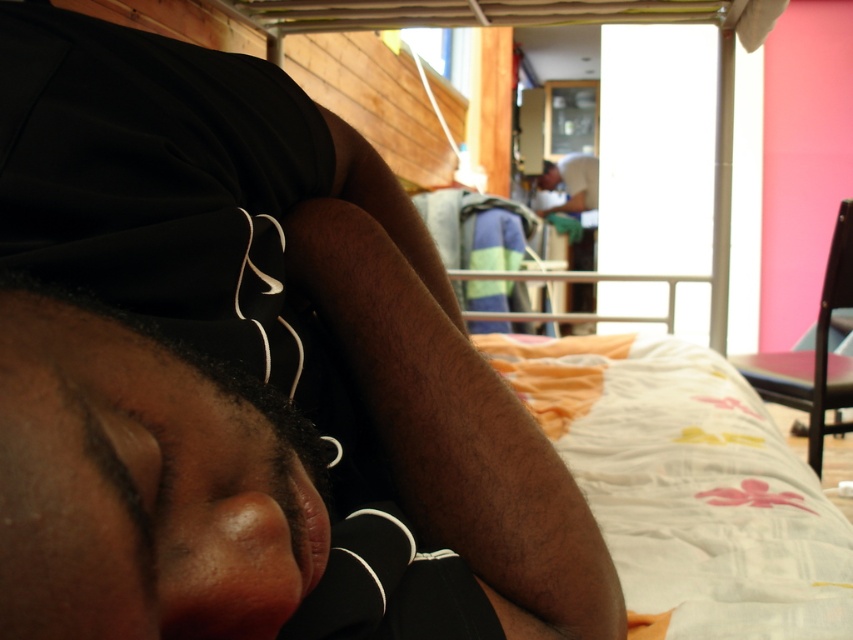
Can you confirm if black fabric at center is positioned above white cotton shirt at center?

No.

Which is behind, point (576, 582) or point (579, 182)?

The point (579, 182) is more distant.

This screenshot has width=853, height=640. Find the location of `black fabric at center`. black fabric at center is located at coordinates (247, 372).

Does black fabric at center appear on the right side of black matte head at center?

Yes, black fabric at center is to the right of black matte head at center.

Which of these two, black fabric at center or black matte head at center, stands shorter?

Standing shorter between the two is black matte head at center.

Image resolution: width=853 pixels, height=640 pixels. Find the location of `black fabric at center`. black fabric at center is located at coordinates (247, 372).

Is black matte head at center above white cotton shirt at center?

No, black matte head at center is not above white cotton shirt at center.

Consider the image. Can you confirm if black matte head at center is smaller than white cotton shirt at center?

Yes.

What do you see at coordinates (144, 483) in the screenshot? I see `black matte head at center` at bounding box center [144, 483].

I want to click on black matte head at center, so click(144, 483).